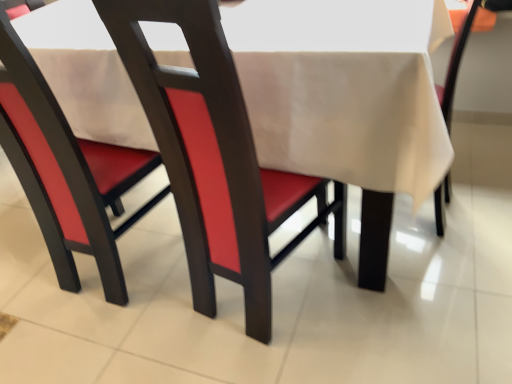
Identify the location of beige fabric chair at center, the 3th chair from the left. The height and width of the screenshot is (384, 512). (374, 239).

Where is `beige fabric tablecloth at center`? The width and height of the screenshot is (512, 384). beige fabric tablecloth at center is located at coordinates (344, 89).

What is the approximate height of matte red chair at center, arranged as the 3th chair when viewed from the right?

matte red chair at center, arranged as the 3th chair when viewed from the right, is 38.38 inches tall.

Where is `matte red chair at center, acting as the 1th chair starting from the left`? matte red chair at center, acting as the 1th chair starting from the left is located at coordinates (66, 170).

Describe the element at coordinates (215, 156) in the screenshot. The image size is (512, 384). I see `matte wood chair at center, which is counted as the second chair, starting from the right` at that location.

Locate an element on the screen. beige fabric chair at center, the 3th chair from the left is located at coordinates (374, 239).

Find the location of a particular element. Image resolution: width=512 pixels, height=384 pixels. the 1st chair behind the matte wood chair at center, arranged as the second chair when viewed from the left, counting from the anchor's position is located at coordinates (66, 170).

Based on the photo, is matte red chair at center, acting as the 1th chair starting from the left, facing towards matte wood chair at center, arranged as the second chair when viewed from the left?

No, matte red chair at center, acting as the 1th chair starting from the left, is not turned towards matte wood chair at center, arranged as the second chair when viewed from the left.

Based on the photo, does matte red chair at center, arranged as the 3th chair when viewed from the right, contain matte wood chair at center, arranged as the second chair when viewed from the left?

No, matte wood chair at center, arranged as the second chair when viewed from the left, is located outside of matte red chair at center, arranged as the 3th chair when viewed from the right.

Does beige fabric chair at center, the 3th chair from the left, turn towards matte wood chair at center, arranged as the second chair when viewed from the left?

No, beige fabric chair at center, the 3th chair from the left, does not turn towards matte wood chair at center, arranged as the second chair when viewed from the left.

The image size is (512, 384). Identify the location of chair directly beneath the matte wood chair at center, which is counted as the second chair, starting from the right (from a real-world perspective). (374, 239).

Based on their sizes in the image, would you say beige fabric chair at center, marked as the 1th chair in a right-to-left arrangement, is bigger or smaller than matte wood chair at center, arranged as the second chair when viewed from the left?

In the image, beige fabric chair at center, marked as the 1th chair in a right-to-left arrangement, appears to be smaller than matte wood chair at center, arranged as the second chair when viewed from the left.

Considering the positions of point (464, 21) and point (256, 158), is point (464, 21) closer or farther from the camera than point (256, 158)?

Clearly, point (464, 21) is more distant from the camera than point (256, 158).

Between beige fabric chair at center, marked as the 1th chair in a right-to-left arrangement, and matte red chair at center, acting as the 1th chair starting from the left, which one has smaller width?

matte red chair at center, acting as the 1th chair starting from the left, is thinner.

From the image's perspective, which one is positioned lower, beige fabric chair at center, marked as the 1th chair in a right-to-left arrangement, or matte red chair at center, acting as the 1th chair starting from the left?

matte red chair at center, acting as the 1th chair starting from the left, appears lower in the image.

Is matte red chair at center, acting as the 1th chair starting from the left, completely or partially inside beige fabric chair at center, marked as the 1th chair in a right-to-left arrangement?

No, beige fabric chair at center, marked as the 1th chair in a right-to-left arrangement, does not contain matte red chair at center, acting as the 1th chair starting from the left.

From the picture: Considering the relative sizes of beige fabric chair at center, marked as the 1th chair in a right-to-left arrangement, and matte red chair at center, acting as the 1th chair starting from the left, in the image provided, is beige fabric chair at center, marked as the 1th chair in a right-to-left arrangement, shorter than matte red chair at center, acting as the 1th chair starting from the left,?

Correct, beige fabric chair at center, marked as the 1th chair in a right-to-left arrangement, is not as tall as matte red chair at center, acting as the 1th chair starting from the left.

From the image's perspective, is matte red chair at center, acting as the 1th chair starting from the left, above or below beige fabric chair at center, the 3th chair from the left?

matte red chair at center, acting as the 1th chair starting from the left, is situated lower than beige fabric chair at center, the 3th chair from the left, in the image.

Is matte red chair at center, acting as the 1th chair starting from the left, wider than beige fabric chair at center, marked as the 1th chair in a right-to-left arrangement?

Incorrect, the width of matte red chair at center, acting as the 1th chair starting from the left, does not surpass that of beige fabric chair at center, marked as the 1th chair in a right-to-left arrangement.

Is beige fabric chair at center, marked as the 1th chair in a right-to-left arrangement, located within matte red chair at center, acting as the 1th chair starting from the left?

Actually, beige fabric chair at center, marked as the 1th chair in a right-to-left arrangement, is outside matte red chair at center, acting as the 1th chair starting from the left.

Which is nearer, [15,164] or [377,231]?

The point [377,231] is in front.

Are matte wood chair at center, which is counted as the second chair, starting from the right, and matte red chair at center, acting as the 1th chair starting from the left, making contact?

No, matte wood chair at center, which is counted as the second chair, starting from the right, is not with matte red chair at center, acting as the 1th chair starting from the left.

From a real-world perspective, is matte wood chair at center, which is counted as the second chair, starting from the right, positioned above or below matte red chair at center, acting as the 1th chair starting from the left?

matte wood chair at center, which is counted as the second chair, starting from the right, is situated lower than matte red chair at center, acting as the 1th chair starting from the left, in the real world.

Is matte red chair at center, acting as the 1th chair starting from the left, at the back of matte wood chair at center, which is counted as the second chair, starting from the right?

No, matte wood chair at center, which is counted as the second chair, starting from the right, is not facing the opposite direction of matte red chair at center, acting as the 1th chair starting from the left.

What's the angular difference between matte wood chair at center, arranged as the second chair when viewed from the left, and matte red chair at center, acting as the 1th chair starting from the left,'s facing directions?

matte wood chair at center, arranged as the second chair when viewed from the left, and matte red chair at center, acting as the 1th chair starting from the left, are facing 11.2 degrees away from each other.

Could matte wood chair at center, arranged as the second chair when viewed from the left, be considered to be inside beige fabric tablecloth at center?

Absolutely, matte wood chair at center, arranged as the second chair when viewed from the left, is inside beige fabric tablecloth at center.

Considering the relative sizes of beige fabric tablecloth at center and matte wood chair at center, which is counted as the second chair, starting from the right, in the image provided, is beige fabric tablecloth at center shorter than matte wood chair at center, which is counted as the second chair, starting from the right,?

Yes.

Considering the relative positions of beige fabric tablecloth at center and matte wood chair at center, arranged as the second chair when viewed from the left, in the image provided, is beige fabric tablecloth at center behind matte wood chair at center, arranged as the second chair when viewed from the left,?

Yes, it is.

Is beige fabric tablecloth at center bigger than matte wood chair at center, arranged as the second chair when viewed from the left?

Correct, beige fabric tablecloth at center is larger in size than matte wood chair at center, arranged as the second chair when viewed from the left.

Is matte red chair at center, arranged as the 3th chair when viewed from the right, to the left or to the right of beige fabric tablecloth at center in the image?

Clearly, matte red chair at center, arranged as the 3th chair when viewed from the right, is on the left of beige fabric tablecloth at center in the image.

Identify the location of tablecloth located above the matte red chair at center, acting as the 1th chair starting from the left (from the image's perspective). The width and height of the screenshot is (512, 384). (344, 89).

Which object is more forward, matte red chair at center, arranged as the 3th chair when viewed from the right, or beige fabric tablecloth at center?

beige fabric tablecloth at center is more forward.

Between matte red chair at center, acting as the 1th chair starting from the left, and beige fabric tablecloth at center, which one has less height?

Standing shorter between the two is beige fabric tablecloth at center.

This screenshot has height=384, width=512. Find the location of `chair below the matte red chair at center, arranged as the 3th chair when viewed from the right (from the image's perspective)`. chair below the matte red chair at center, arranged as the 3th chair when viewed from the right (from the image's perspective) is located at coordinates (215, 156).

The image size is (512, 384). Identify the location of the 2nd chair behind when counting from the matte wood chair at center, which is counted as the second chair, starting from the right. (374, 239).

From the picture: From the image, which object appears to be farther from matte red chair at center, acting as the 1th chair starting from the left, beige fabric chair at center, marked as the 1th chair in a right-to-left arrangement, or beige fabric tablecloth at center?

beige fabric chair at center, marked as the 1th chair in a right-to-left arrangement, is positioned further to the anchor matte red chair at center, acting as the 1th chair starting from the left.

From the image, which object appears to be farther from beige fabric chair at center, marked as the 1th chair in a right-to-left arrangement, matte wood chair at center, arranged as the second chair when viewed from the left, or matte red chair at center, arranged as the 3th chair when viewed from the right?

The object further to beige fabric chair at center, marked as the 1th chair in a right-to-left arrangement, is matte red chair at center, arranged as the 3th chair when viewed from the right.

Based on their spatial positions, is beige fabric tablecloth at center or beige fabric chair at center, the 3th chair from the left, closer to matte wood chair at center, which is counted as the second chair, starting from the right?

beige fabric tablecloth at center.

From the image, which object appears to be nearer to matte wood chair at center, arranged as the second chair when viewed from the left, matte red chair at center, acting as the 1th chair starting from the left, or beige fabric tablecloth at center?

beige fabric tablecloth at center is closer to matte wood chair at center, arranged as the second chair when viewed from the left.

From the image, which object appears to be nearer to beige fabric chair at center, marked as the 1th chair in a right-to-left arrangement, matte red chair at center, arranged as the 3th chair when viewed from the right, or matte wood chair at center, arranged as the second chair when viewed from the left?

matte wood chair at center, arranged as the second chair when viewed from the left, is closer to beige fabric chair at center, marked as the 1th chair in a right-to-left arrangement.

Which object lies further to the anchor point beige fabric tablecloth at center, matte wood chair at center, arranged as the second chair when viewed from the left, or matte red chair at center, acting as the 1th chair starting from the left?

Based on the image, matte red chair at center, acting as the 1th chair starting from the left, appears to be further to beige fabric tablecloth at center.

Looking at the image, which one is located closer to matte red chair at center, arranged as the 3th chair when viewed from the right, beige fabric chair at center, marked as the 1th chair in a right-to-left arrangement, or matte wood chair at center, arranged as the second chair when viewed from the left?

matte wood chair at center, arranged as the second chair when viewed from the left, lies closer to matte red chair at center, arranged as the 3th chair when viewed from the right, than the other object.

Considering their positions, is matte red chair at center, acting as the 1th chair starting from the left, positioned further to beige fabric chair at center, marked as the 1th chair in a right-to-left arrangement, than beige fabric tablecloth at center?

Among the two, matte red chair at center, acting as the 1th chair starting from the left, is located further to beige fabric chair at center, marked as the 1th chair in a right-to-left arrangement.

You are a GUI agent. You are given a task and a screenshot of the screen. Output one action in this format:
    pyautogui.click(x=<x>, y=<y>)
    Task: Click on the tablecloth between matte red chair at center, acting as the 1th chair starting from the left, and matte wood chair at center, which is counted as the second chair, starting from the right, from left to right
    
    Given the screenshot: What is the action you would take?
    pyautogui.click(x=344, y=89)

You are a GUI agent. You are given a task and a screenshot of the screen. Output one action in this format:
    pyautogui.click(x=<x>, y=<y>)
    Task: Click on the chair located between beige fabric tablecloth at center and beige fabric chair at center, the 3th chair from the left, in the left-right direction
    The image size is (512, 384).
    Given the screenshot: What is the action you would take?
    pyautogui.click(x=215, y=156)

Where is `chair located between matte red chair at center, acting as the 1th chair starting from the left, and beige fabric chair at center, marked as the 1th chair in a right-to-left arrangement, in the left-right direction`? The image size is (512, 384). chair located between matte red chair at center, acting as the 1th chair starting from the left, and beige fabric chair at center, marked as the 1th chair in a right-to-left arrangement, in the left-right direction is located at coordinates (215, 156).

This screenshot has height=384, width=512. Find the location of `tablecloth between matte red chair at center, arranged as the 3th chair when viewed from the right, and beige fabric chair at center, the 3th chair from the left, from left to right`. tablecloth between matte red chair at center, arranged as the 3th chair when viewed from the right, and beige fabric chair at center, the 3th chair from the left, from left to right is located at coordinates tap(344, 89).